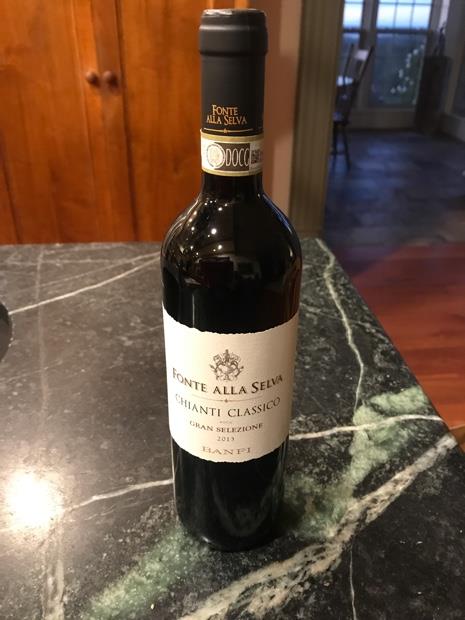
This screenshot has height=620, width=465. What are the coordinates of `door knobs` in the screenshot? It's located at (109, 76), (92, 78).